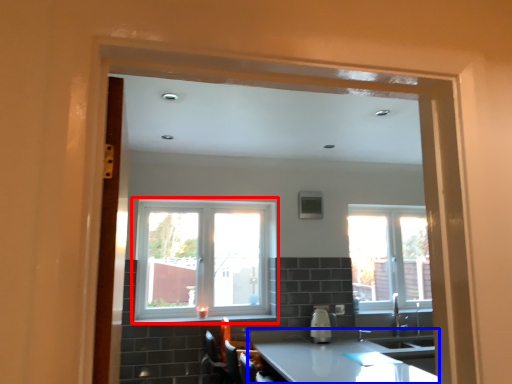
Question: Which object appears farthest to the camera in this image, window (highlighted by a red box) or countertop (highlighted by a blue box)?

Choices:
 (A) window
 (B) countertop

Answer: (A)